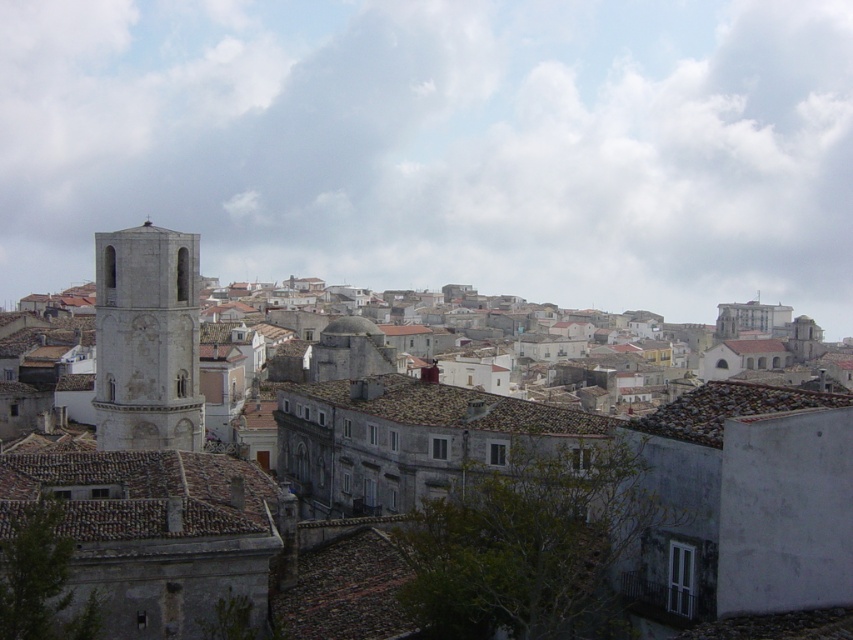
Question: Which object appears farthest from the camera in this image?

Choices:
 (A) stone tower at left
 (B) brown tile roof at center

Answer: (B)

Question: Does stone tower at left have a larger size compared to gray stone bell tower at left?

Choices:
 (A) yes
 (B) no

Answer: (A)

Question: Which object appears closest to the camera in this image?

Choices:
 (A) brown tile roof at center
 (B) stone tower at left

Answer: (B)

Question: Is stone tower at left above gray stone bell tower at left?

Choices:
 (A) no
 (B) yes

Answer: (A)

Question: Which object appears closest to the camera in this image?

Choices:
 (A) brown tile roof at center
 (B) gray stone bell tower at left
 (C) stone tower at left

Answer: (C)

Question: Does gray stone bell tower at left have a lesser width compared to brown tile roof at center?

Choices:
 (A) yes
 (B) no

Answer: (A)